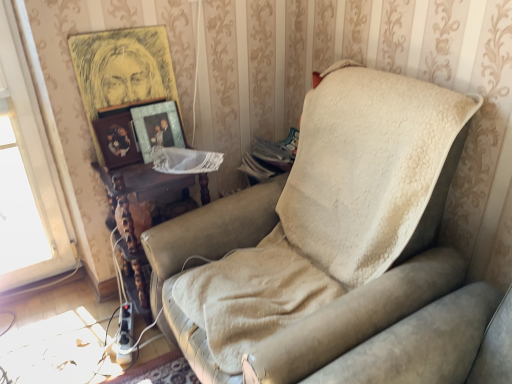
Question: Is metallic gold picture frame at upper center, placed as the 2th picture frame when sorted from bottom to top, completely or partially outside of woodenobject at left, acting as the first picture frame starting from the bottom?

Choices:
 (A) no
 (B) yes

Answer: (B)

Question: From the image's perspective, does metallic gold picture frame at upper center, placed as the 2th picture frame when sorted from bottom to top, appear higher than woodenobject at left, acting as the first picture frame starting from the bottom?

Choices:
 (A) no
 (B) yes

Answer: (B)

Question: Can you confirm if metallic gold picture frame at upper center, placed as the 2th picture frame when sorted from bottom to top, is smaller than woodenobject at left, the 3th picture frame viewed from the top?

Choices:
 (A) no
 (B) yes

Answer: (A)

Question: Does metallic gold picture frame at upper center, the second picture frame when ordered from top to bottom, appear on the left side of woodenobject at left, acting as the first picture frame starting from the bottom?

Choices:
 (A) no
 (B) yes

Answer: (A)

Question: Considering the relative sizes of metallic gold picture frame at upper center, the second picture frame when ordered from top to bottom, and woodenobject at left, acting as the first picture frame starting from the bottom, in the image provided, is metallic gold picture frame at upper center, the second picture frame when ordered from top to bottom, shorter than woodenobject at left, acting as the first picture frame starting from the bottom,?

Choices:
 (A) no
 (B) yes

Answer: (A)

Question: Can you confirm if metallic gold picture frame at upper center, the second picture frame when ordered from top to bottom, is taller than woodenobject at left, the 3th picture frame viewed from the top?

Choices:
 (A) yes
 (B) no

Answer: (A)

Question: Is metallic gold picture frame at upper center, the second picture frame when ordered from top to bottom, shorter than woodenmaterial/texturetable at center?

Choices:
 (A) no
 (B) yes

Answer: (B)

Question: Does metallic gold picture frame at upper center, placed as the 2th picture frame when sorted from bottom to top, have a smaller size compared to woodenmaterial/texturetable at center?

Choices:
 (A) yes
 (B) no

Answer: (A)

Question: Is metallic gold picture frame at upper center, placed as the 2th picture frame when sorted from bottom to top, beside woodenmaterial/texturetable at center?

Choices:
 (A) yes
 (B) no

Answer: (B)

Question: Is metallic gold picture frame at upper center, the second picture frame when ordered from top to bottom, to the left of woodenmaterial/texturetable at center from the viewer's perspective?

Choices:
 (A) yes
 (B) no

Answer: (B)

Question: Is metallic gold picture frame at upper center, the second picture frame when ordered from top to bottom, facing towards woodenmaterial/texturetable at center?

Choices:
 (A) yes
 (B) no

Answer: (B)

Question: Is metallic gold picture frame at upper center, placed as the 2th picture frame when sorted from bottom to top, taller than woodenmaterial/texturetable at center?

Choices:
 (A) yes
 (B) no

Answer: (B)

Question: Is wooden picture frame at upper left, the first picture frame positioned from the top, looking in the opposite direction of woodenobject at left, the 3th picture frame viewed from the top?

Choices:
 (A) no
 (B) yes

Answer: (B)